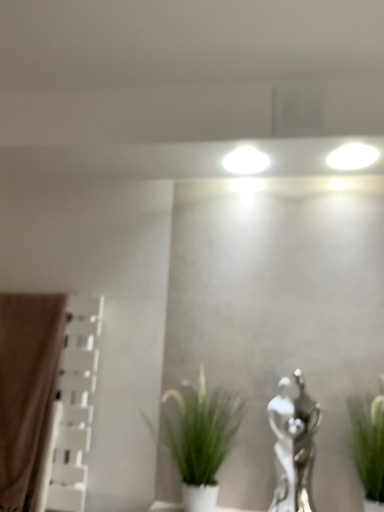
Question: From the image's perspective, relative to silver metallic statue at center-right, is green leafy plant at right, marked as the 2th houseplant in a left-to-right arrangement, above or below?

Choices:
 (A) below
 (B) above

Answer: (B)

Question: Visually, is green leafy plant at right, arranged as the first houseplant when viewed from the right, positioned to the left or to the right of silver metallic statue at center-right?

Choices:
 (A) left
 (B) right

Answer: (B)

Question: Based on their relative distances, which object is nearer to the brown fabric curtain at left?

Choices:
 (A) silver metallic statue at center-right
 (B) green matte plant at center, the first houseplant when ordered from left to right
 (C) green leafy plant at right, marked as the 2th houseplant in a left-to-right arrangement

Answer: (B)

Question: Considering the real-world distances, which object is farthest from the brown fabric curtain at left?

Choices:
 (A) green matte plant at center, the first houseplant when ordered from left to right
 (B) silver metallic statue at center-right
 (C) green leafy plant at right, marked as the 2th houseplant in a left-to-right arrangement

Answer: (C)